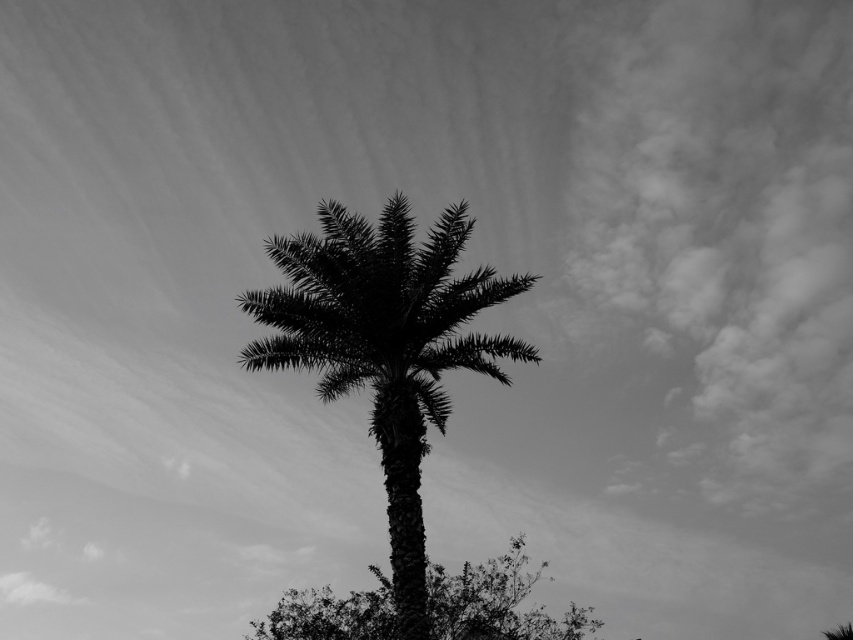
Question: Can you confirm if silhouette leafy palm at center is bigger than silhouette leafy tree at center?

Choices:
 (A) no
 (B) yes

Answer: (B)

Question: Can you confirm if silhouette leafy palm at center is thinner than silhouette leafy tree at center?

Choices:
 (A) yes
 (B) no

Answer: (A)

Question: Does silhouette leafy palm at center appear under silhouette leafy tree at center?

Choices:
 (A) yes
 (B) no

Answer: (B)